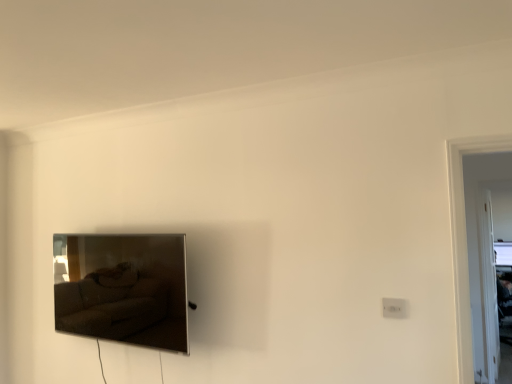
Question: Is point (146, 339) positioned closer to the camera than point (392, 317)?

Choices:
 (A) farther
 (B) closer

Answer: (A)

Question: Is matte black tv at left situated inside white plastic electric outlet at lower right or outside?

Choices:
 (A) inside
 (B) outside

Answer: (B)

Question: From a real-world perspective, is matte black tv at left positioned above or below white plastic electric outlet at lower right?

Choices:
 (A) above
 (B) below

Answer: (A)

Question: From the image's perspective, is white plastic electric outlet at lower right positioned above or below matte black tv at left?

Choices:
 (A) below
 (B) above

Answer: (B)

Question: Does point pyautogui.click(x=395, y=314) appear closer or farther from the camera than point pyautogui.click(x=166, y=340)?

Choices:
 (A) farther
 (B) closer

Answer: (B)

Question: In terms of width, does white plastic electric outlet at lower right look wider or thinner when compared to matte black tv at left?

Choices:
 (A) thin
 (B) wide

Answer: (A)

Question: Based on their sizes in the image, would you say white plastic electric outlet at lower right is bigger or smaller than matte black tv at left?

Choices:
 (A) small
 (B) big

Answer: (A)